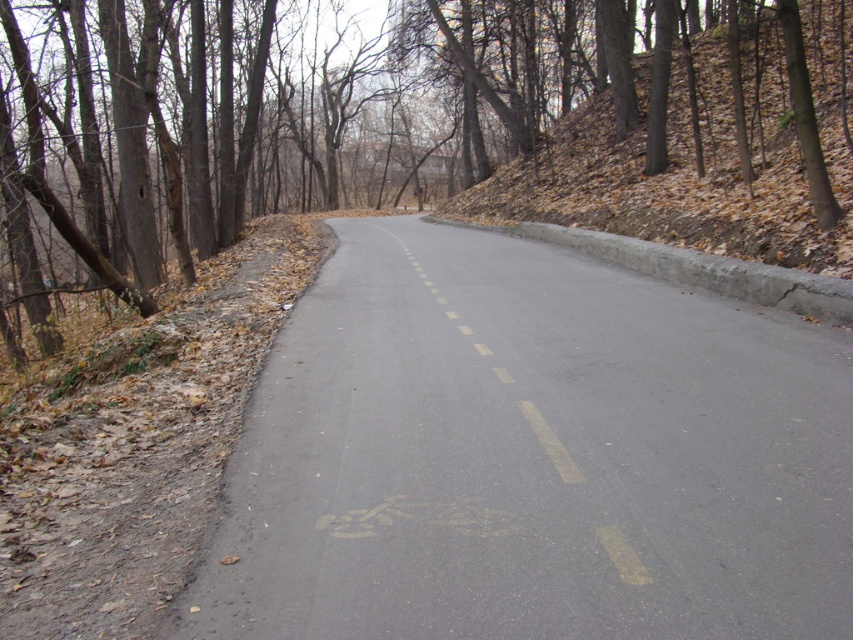
Who is more forward, (216, 540) or (184, 17)?

Point (216, 540)

Does asphalt road at center have a greater height compared to brown bark tree at center?

No, asphalt road at center is not taller than brown bark tree at center.

Which is behind, point (357, 522) or point (276, 161)?

The point (276, 161) is behind.

Identify the location of asphalt road at center. (531, 458).